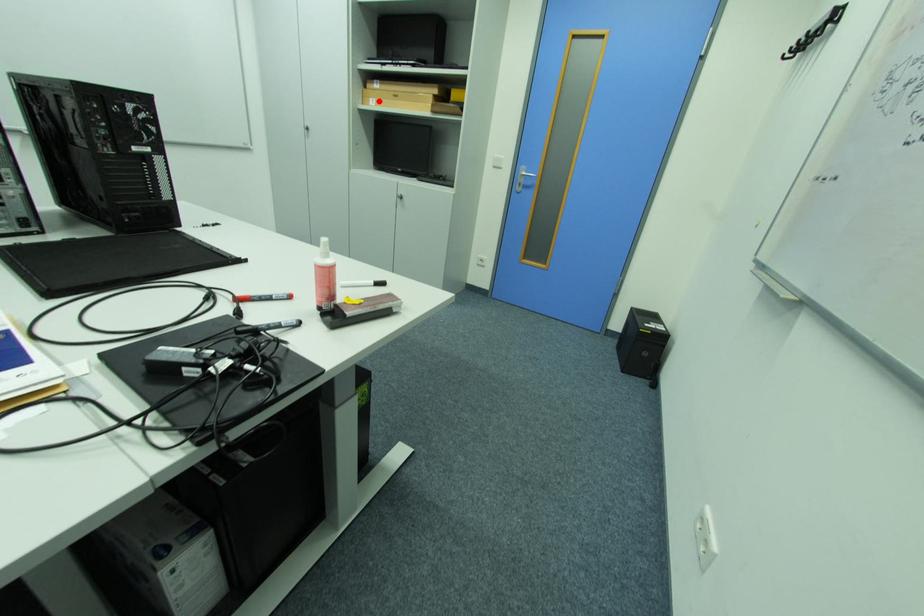
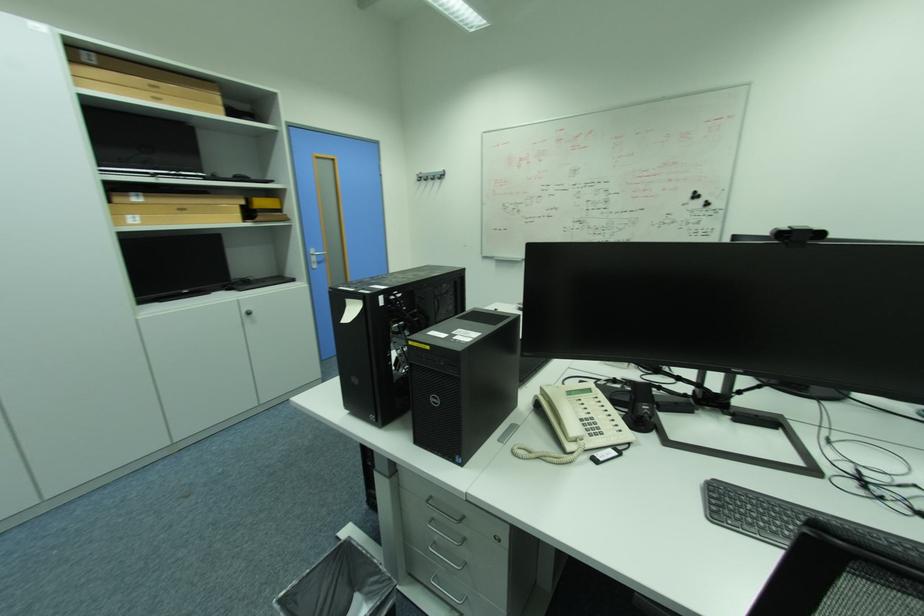
Question: I am providing you with two images of the same scene from different viewpoints. Image1 has a red point marked. In image2, the corresponding 3D location appears at what relative position? Reply with the corresponding letter.

Choices:
 (A) Closer
 (B) Farther

Answer: (B)